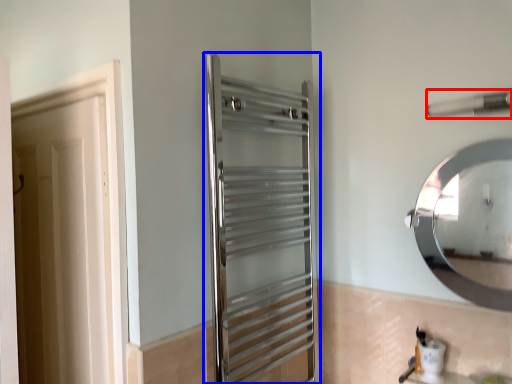
Question: Which of the following is the farthest to the observer, towel bar (highlighted by a red box) or screen door (highlighted by a blue box)?

Choices:
 (A) towel bar
 (B) screen door

Answer: (A)